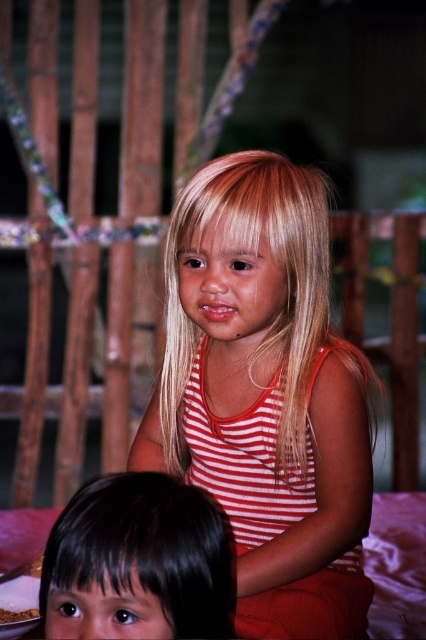
You are standing in a room with two children. There is a point at coordinates (170, 472) that you want to reach. If you are 1.50 meters away from this point, can you comfortably walk to it without moving the children?

The point at (170, 472) is 1.50 meters away from you, so yes, you can comfortably walk to it without needing to move the children as the distance is manageable.

You are a photographer trying to capture a closeup of the striped fabric tank top at center and the black hair at lower left. Which object should you zoom in on first to ensure both fit in the frame without moving the camera?

You should zoom in on the striped fabric tank top at center first because its width is larger than the black hair at lower left, so adjusting the zoom to accommodate its size will ensure both fit in the frame.

You are a photographer setting up for a group shot. You need to position the black hair at lower left and the striped fabric tank top at center so that both are visible. Based on their current positions, which object is blocking the view of the other?

The black hair at lower left is behind striped fabric tank top at center, so the striped fabric tank top at center is blocking the view of the black hair at lower left.